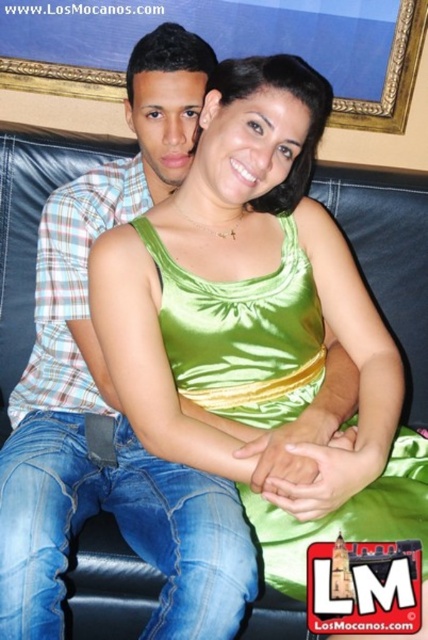
Question: Among these objects, which one is nearest to the camera?

Choices:
 (A) gold-framed picture at upper center
 (B) green satin tank top at center

Answer: (B)

Question: Is green satin tank top at center thinner than gold-framed picture at upper center?

Choices:
 (A) yes
 (B) no

Answer: (B)

Question: Considering the relative positions of green satin tank top at center and gold-framed picture at upper center in the image provided, where is green satin tank top at center located with respect to gold-framed picture at upper center?

Choices:
 (A) above
 (B) below

Answer: (B)

Question: Among these points, which one is farthest from the camera?

Choices:
 (A) (344, 64)
 (B) (166, 272)

Answer: (A)

Question: Is green satin tank top at center bigger than gold-framed picture at upper center?

Choices:
 (A) yes
 (B) no

Answer: (A)

Question: Which point appears farthest from the camera in this image?

Choices:
 (A) (300, 595)
 (B) (122, 77)

Answer: (B)